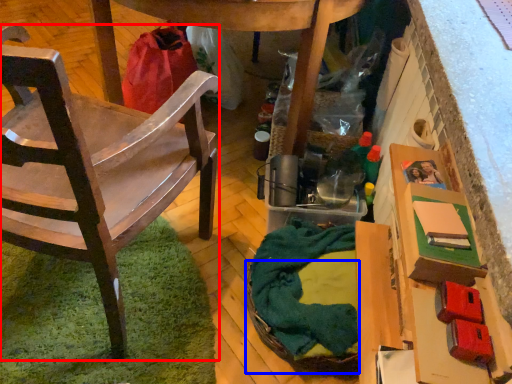
Question: Which point is further to the camera, chair (highlighted by a red box) or basket (highlighted by a blue box)?

Choices:
 (A) chair
 (B) basket

Answer: (B)